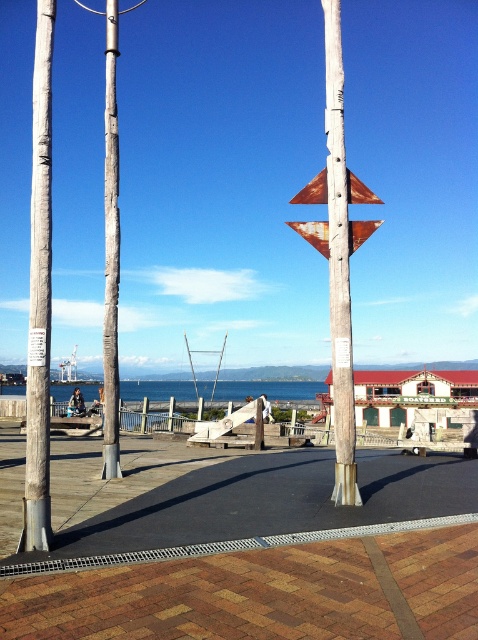
From the picture: Does rusty wood flagpole at center have a greater height compared to rusty metal sign at center?

Indeed, rusty wood flagpole at center has a greater height compared to rusty metal sign at center.

Can you confirm if rusty wood flagpole at center is bigger than rusty metal sign at center?

Yes.

Is point (339, 244) closer to viewer compared to point (326, 230)?

Yes, it is.

Identify the location of rusty wood flagpole at center. The height and width of the screenshot is (640, 478). (338, 264).

What do you see at coordinates (40, 296) in the screenshot? I see `gray wood pole at left` at bounding box center [40, 296].

Which is more to the right, gray wood pole at left or weathered wood pole at left?

Positioned to the right is gray wood pole at left.

The width and height of the screenshot is (478, 640). Find the location of `gray wood pole at left`. gray wood pole at left is located at coordinates (40, 296).

Between weathered wood pole at left and rusty metal sign at center, which one is positioned lower?

rusty metal sign at center

You are a GUI agent. You are given a task and a screenshot of the screen. Output one action in this format:
    pyautogui.click(x=<x>, y=<y>)
    Task: Click on the weathered wood pole at left
    The width and height of the screenshot is (478, 640).
    Given the screenshot: What is the action you would take?
    pyautogui.click(x=110, y=252)